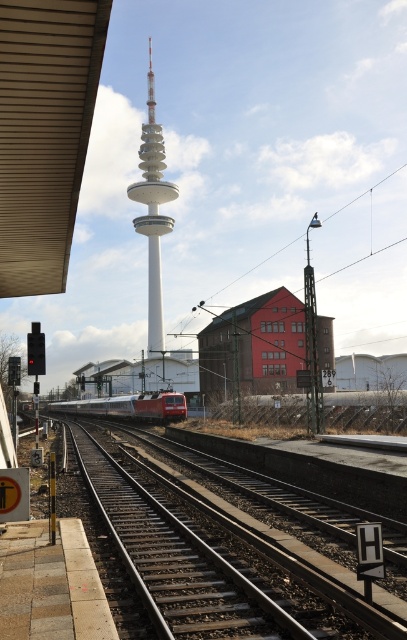
Question: Estimate the real-world distances between objects in this image. Which object is closer to the smooth metal train track at center?

Choices:
 (A) red glossy train at center
 (B) white smooth tower at center

Answer: (A)

Question: Does smooth metal train track at center lie in front of white smooth tower at center?

Choices:
 (A) yes
 (B) no

Answer: (A)

Question: Which object is farther from the camera taking this photo?

Choices:
 (A) red glossy train at center
 (B) white smooth tower at center

Answer: (B)

Question: Considering the relative positions of smooth metal train track at center and red glossy train at center in the image provided, where is smooth metal train track at center located with respect to red glossy train at center?

Choices:
 (A) left
 (B) right

Answer: (B)

Question: Is smooth metal train track at center wider than red glossy train at center?

Choices:
 (A) yes
 (B) no

Answer: (B)

Question: Which is nearer to the white smooth tower at center?

Choices:
 (A) smooth metal train track at center
 (B) red glossy train at center

Answer: (B)